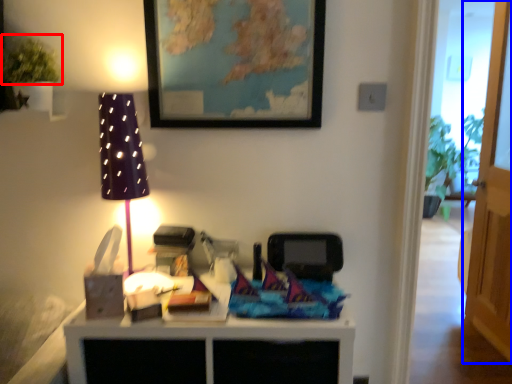
Question: Which object is closer to the camera taking this photo, plant (highlighted by a red box) or glass door (highlighted by a blue box)?

Choices:
 (A) plant
 (B) glass door

Answer: (A)